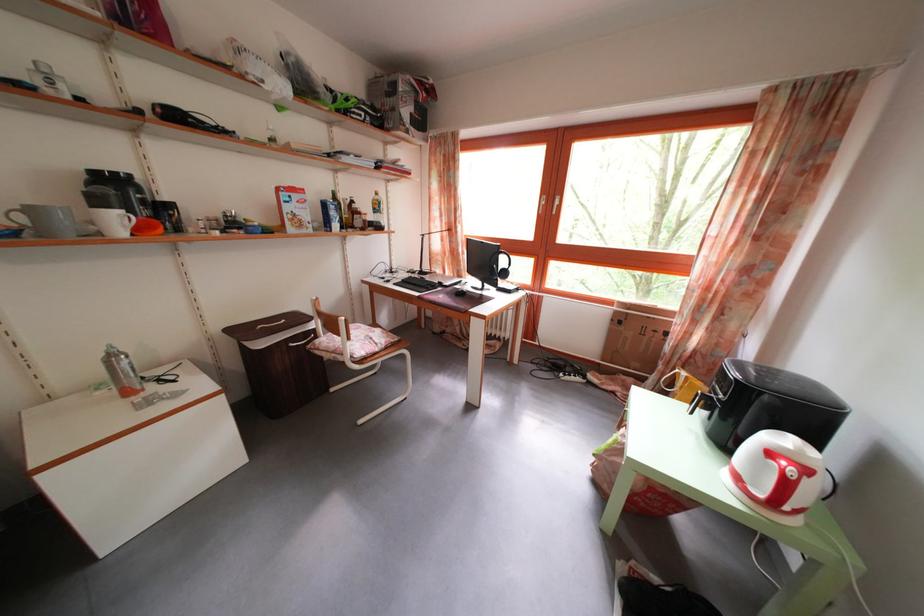
Where would you lift the grey mug handle? Please return your answer as a coordinate pair (x, y).

(112, 222)